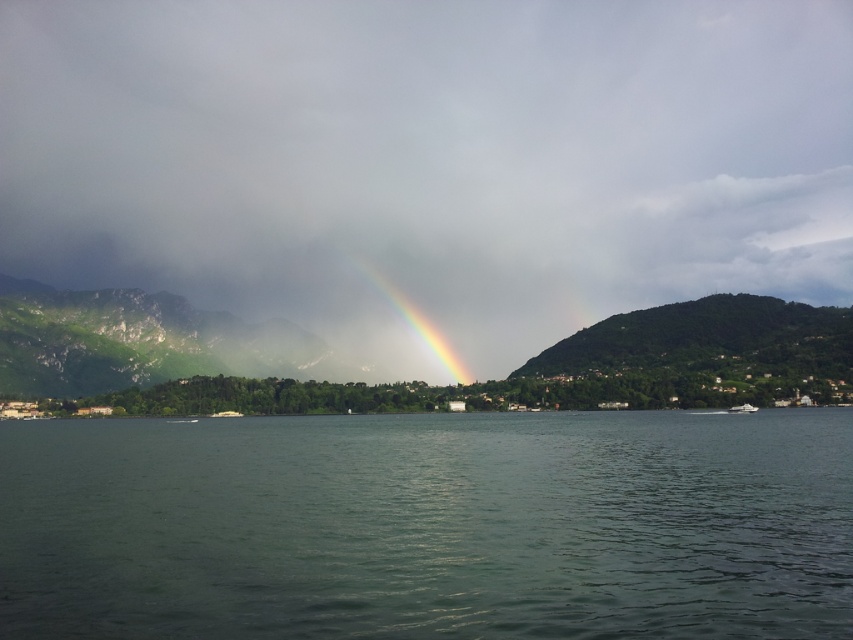
Question: Can you confirm if green water at center is thinner than white glossy boat at lower right?

Choices:
 (A) no
 (B) yes

Answer: (A)

Question: Which point is farther from the camera taking this photo?

Choices:
 (A) (422, 314)
 (B) (776, 333)
 (C) (746, 412)
 (D) (408, 582)

Answer: (A)

Question: Which object is the farthest from the green textured mountain at center?

Choices:
 (A) white glossy boat at lower right
 (B) rainbow at center
 (C) green water at center

Answer: (A)

Question: Does rainbow at center have a lesser width compared to white glossy boat at lower right?

Choices:
 (A) no
 (B) yes

Answer: (A)

Question: Which point is farther from the camera taking this photo?

Choices:
 (A) (751, 406)
 (B) (457, 369)

Answer: (B)

Question: Does green water at center have a larger size compared to white glossy boat at lower right?

Choices:
 (A) yes
 (B) no

Answer: (A)